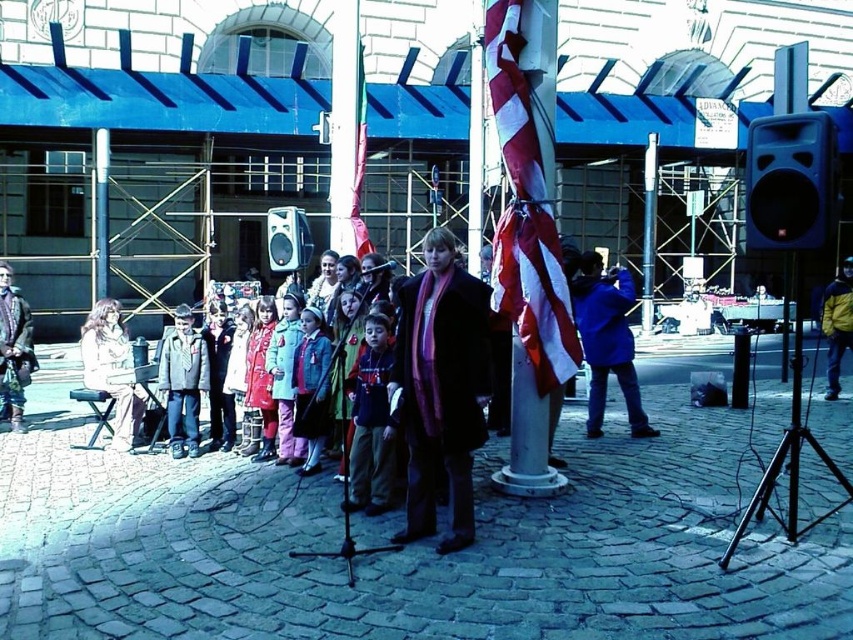
Does point (498, 76) lie in front of point (653, 209)?

That is True.

Can you confirm if american flag at center is taller than metallic pole at center?

No, american flag at center is not taller than metallic pole at center.

From the picture: Measure the distance between point (x=547, y=365) and camera.

They are 6.35 meters apart.

I want to click on american flag at center, so click(x=526, y=212).

Can you confirm if american flag at center is thinner than dark blue fleece at center?

No, american flag at center is not thinner than dark blue fleece at center.

Between american flag at center and dark blue fleece at center, which one has less height?

dark blue fleece at center

Locate an element on the screen. The image size is (853, 640). american flag at center is located at coordinates coord(526,212).

Looking at this image, measure the distance from dark blue fleece at center to denim jacket at center.

They are 1.17 meters apart.

Is dark blue fleece at center thinner than denim jacket at center?

Correct, dark blue fleece at center's width is less than denim jacket at center's.

Image resolution: width=853 pixels, height=640 pixels. What do you see at coordinates (370, 422) in the screenshot? I see `dark blue fleece at center` at bounding box center [370, 422].

Where is `dark blue fleece at center`? dark blue fleece at center is located at coordinates [370, 422].